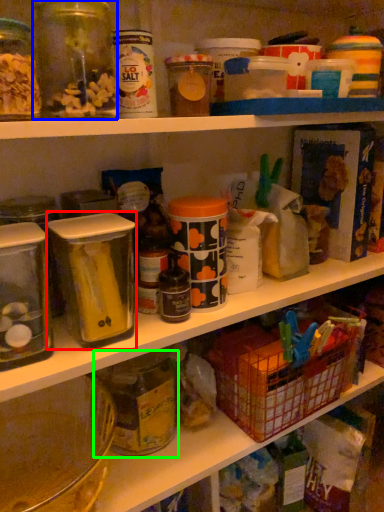
Question: Which object is the closest to the carton (highlighted by a red box)? Choose among these: glass jar (highlighted by a blue box) or glass jar (highlighted by a green box).

Choices:
 (A) glass jar
 (B) glass jar

Answer: (B)